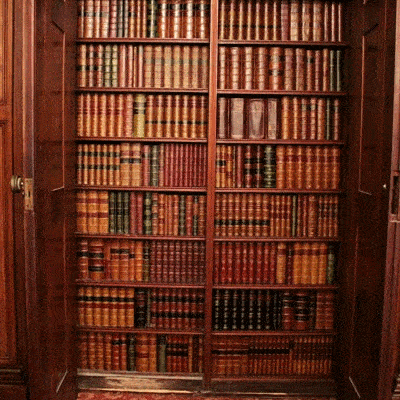
Locate an element on the screen. door latch is located at coordinates (27, 194).